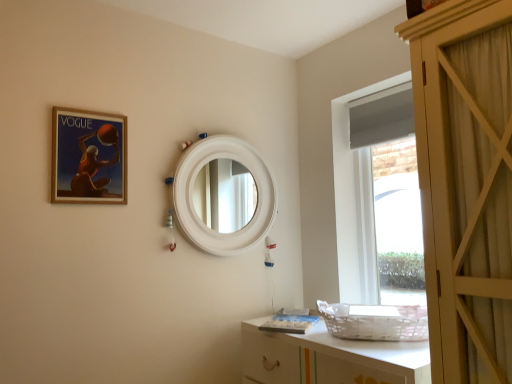
Question: Does matte wooden picture frame at upper left have a greater height compared to white matte mirror at center?

Choices:
 (A) no
 (B) yes

Answer: (A)

Question: From a real-world perspective, is matte wooden picture frame at upper left physically below white matte mirror at center?

Choices:
 (A) no
 (B) yes

Answer: (A)

Question: Can we say matte wooden picture frame at upper left lies outside white matte mirror at center?

Choices:
 (A) yes
 (B) no

Answer: (A)

Question: From a real-world perspective, is matte wooden picture frame at upper left on top of white matte mirror at center?

Choices:
 (A) yes
 (B) no

Answer: (A)

Question: Is matte wooden picture frame at upper left facing towards white matte mirror at center?

Choices:
 (A) yes
 (B) no

Answer: (B)

Question: Is white matte mirror at center a part of matte wooden picture frame at upper left?

Choices:
 (A) no
 (B) yes

Answer: (A)

Question: Is white matte mirror at center smaller than white glossy cabinet at lower right?

Choices:
 (A) yes
 (B) no

Answer: (A)

Question: Is white matte mirror at center positioned behind white glossy cabinet at lower right?

Choices:
 (A) yes
 (B) no

Answer: (A)

Question: From a real-world perspective, is white matte mirror at center over white glossy cabinet at lower right?

Choices:
 (A) yes
 (B) no

Answer: (A)

Question: Is white matte mirror at center positioned with its back to white glossy cabinet at lower right?

Choices:
 (A) no
 (B) yes

Answer: (A)

Question: Does white matte mirror at center have a greater width compared to white glossy cabinet at lower right?

Choices:
 (A) no
 (B) yes

Answer: (A)

Question: Does white matte mirror at center have a lesser height compared to white glossy cabinet at lower right?

Choices:
 (A) yes
 (B) no

Answer: (B)

Question: Can you confirm if white glossy cabinet at lower right is positioned to the left of matte wooden picture frame at upper left?

Choices:
 (A) no
 (B) yes

Answer: (A)